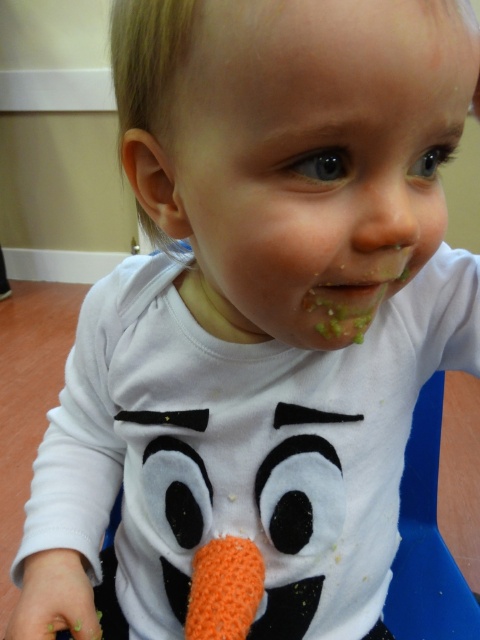
Looking at this image, can you confirm if smooth white face at center is positioned to the right of orange knitted carrot at lower center?

Indeed, smooth white face at center is positioned on the right side of orange knitted carrot at lower center.

Can you confirm if smooth white face at center is positioned to the left of orange knitted carrot at lower center?

In fact, smooth white face at center is to the right of orange knitted carrot at lower center.

Who is more forward, (x=470, y=29) or (x=243, y=548)?

Point (x=470, y=29) is in front.

Image resolution: width=480 pixels, height=640 pixels. Find the location of `smooth white face at center`. smooth white face at center is located at coordinates [313, 157].